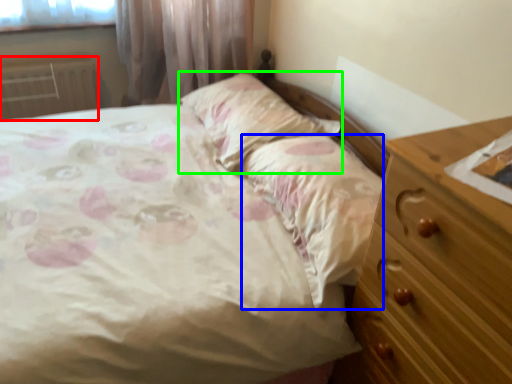
Question: Which is farther away from radiator (highlighted by a red box)? sheet (highlighted by a blue box) or pillow (highlighted by a green box)?

Choices:
 (A) sheet
 (B) pillow

Answer: (A)